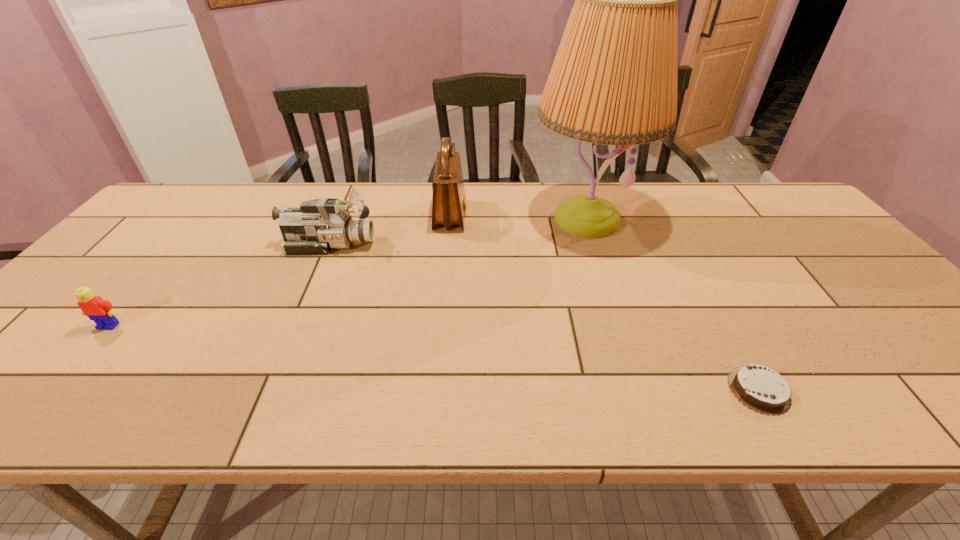
In order to click on vacant space that's between the second object from left to right and the tallest object in this screenshot , I will do `click(458, 232)`.

Where is `vacant region between the lamp and the third object from left to right`? vacant region between the lamp and the third object from left to right is located at coordinates (518, 217).

Where is `the fourth closest object to the nearest object`? This screenshot has width=960, height=540. the fourth closest object to the nearest object is located at coordinates (101, 311).

Where is `the fourth closest object to the third tallest object`? This screenshot has height=540, width=960. the fourth closest object to the third tallest object is located at coordinates (757, 387).

Locate an element on the screen. Image resolution: width=960 pixels, height=540 pixels. blank area in the image that satisfies the following two spatial constraints: 1. on the front flap of the third object from left to right; 2. on the left side of the shortest object is located at coordinates (434, 390).

At what (x,y) coordinates should I click in order to perform the action: click on free space that satisfies the following two spatial constraints: 1. on the side of the tallest object near the pull switch; 2. on the front-facing side of the third shortest object. Please return your answer as a coordinate pair (x, y). Image resolution: width=960 pixels, height=540 pixels. Looking at the image, I should click on (594, 244).

You are a GUI agent. You are given a task and a screenshot of the screen. Output one action in this format:
    pyautogui.click(x=<x>, y=<y>)
    Task: Click on the blank area in the image that satisfies the following two spatial constraints: 1. on the side of the lamp near the pull switch; 2. on the front-facing side of the second object from left to right
    
    Given the screenshot: What is the action you would take?
    pyautogui.click(x=594, y=244)

Where is `free region that satisfies the following two spatial constraints: 1. on the front flap of the shoulder bag; 2. on the back side of the nearest object`? This screenshot has width=960, height=540. free region that satisfies the following two spatial constraints: 1. on the front flap of the shoulder bag; 2. on the back side of the nearest object is located at coordinates pos(434,390).

Locate an element on the screen. free space that satisfies the following two spatial constraints: 1. on the side of the lamp near the pull switch; 2. on the right side of the shortest object is located at coordinates (642, 390).

Image resolution: width=960 pixels, height=540 pixels. I want to click on blank space that satisfies the following two spatial constraints: 1. on the front flap of the shoulder bag; 2. on the front-facing side of the leftmost object, so click(441, 326).